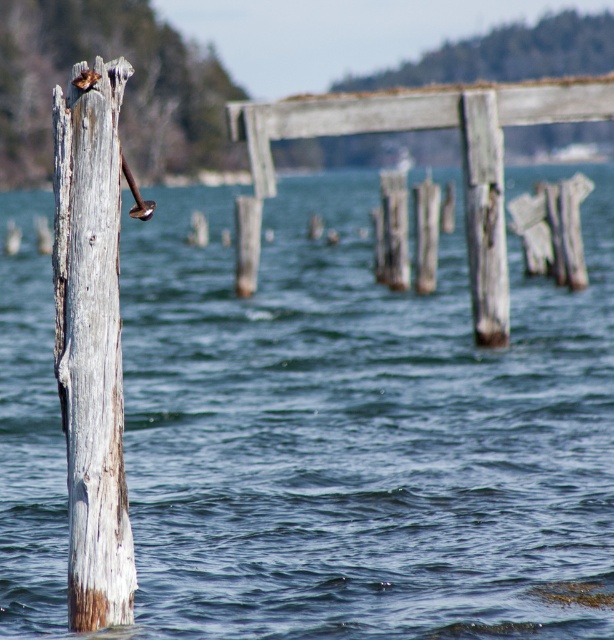
Question: Among these points, which one is farthest from the camera?

Choices:
 (A) (340, 481)
 (B) (119, 516)

Answer: (A)

Question: Estimate the real-world distances between objects in this image. Which object is farther from the weathered wood dock at center?

Choices:
 (A) gray weathered wood post at left
 (B) clear blue water at center

Answer: (B)

Question: Among these objects, which one is farthest from the camera?

Choices:
 (A) weathered wood dock at center
 (B) clear blue water at center
 (C) gray weathered wood post at left

Answer: (A)

Question: Is gray weathered wood post at left behind weathered wood dock at center?

Choices:
 (A) yes
 (B) no

Answer: (B)

Question: Is gray weathered wood post at left positioned behind weathered wood dock at center?

Choices:
 (A) no
 (B) yes

Answer: (A)

Question: Can you confirm if clear blue water at center is positioned to the right of weathered wood dock at center?

Choices:
 (A) no
 (B) yes

Answer: (A)